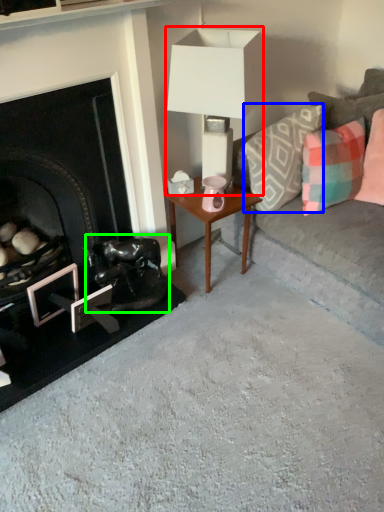
Question: Which is nearer to the table lamp (highlighted by a red box)? pillow (highlighted by a blue box) or swivel chair (highlighted by a green box).

Choices:
 (A) pillow
 (B) swivel chair

Answer: (A)